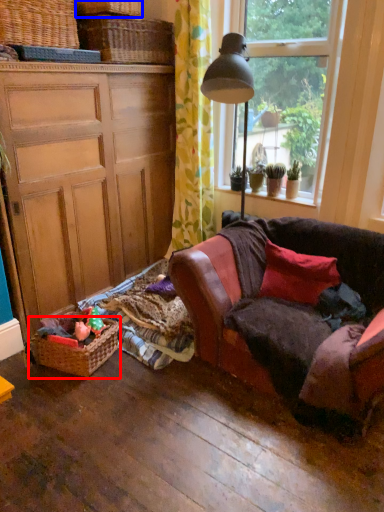
Question: Which of the following is the farthest to the observer, picnic basket (highlighted by a red box) or basket (highlighted by a blue box)?

Choices:
 (A) picnic basket
 (B) basket

Answer: (B)